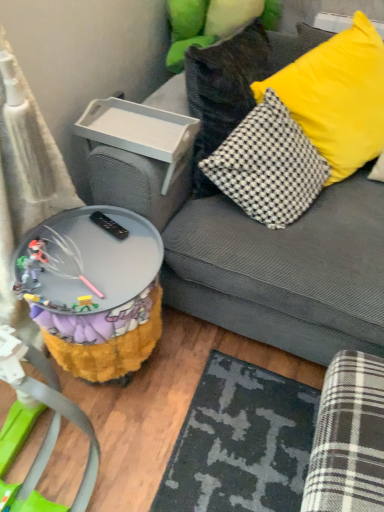
Question: Can we say yellow fabric pillow at upper right lies outside white plastic tray at upper left?

Choices:
 (A) yes
 (B) no

Answer: (A)

Question: Is white plastic tray at upper left surrounded by yellow fabric pillow at upper right?

Choices:
 (A) yes
 (B) no

Answer: (B)

Question: Is yellow fabric pillow at upper right turned away from white plastic tray at upper left?

Choices:
 (A) no
 (B) yes

Answer: (A)

Question: From a real-world perspective, is yellow fabric pillow at upper right over white plastic tray at upper left?

Choices:
 (A) yes
 (B) no

Answer: (A)

Question: Considering the relative positions of yellow fabric pillow at upper right and white plastic tray at upper left in the image provided, is yellow fabric pillow at upper right in front of white plastic tray at upper left?

Choices:
 (A) yes
 (B) no

Answer: (A)

Question: From the image's perspective, is yellow fabric pillow at upper right on white plastic tray at upper left?

Choices:
 (A) no
 (B) yes

Answer: (B)

Question: Is white plastic tray at upper left at the right side of fuzzy fabric table at lower left?

Choices:
 (A) no
 (B) yes

Answer: (B)

Question: Does white plastic tray at upper left have a greater height compared to fuzzy fabric table at lower left?

Choices:
 (A) no
 (B) yes

Answer: (A)

Question: Is white plastic tray at upper left not close to fuzzy fabric table at lower left?

Choices:
 (A) no
 (B) yes

Answer: (A)

Question: Is white plastic tray at upper left not within fuzzy fabric table at lower left?

Choices:
 (A) no
 (B) yes

Answer: (B)

Question: Would you say white plastic tray at upper left contains fuzzy fabric table at lower left?

Choices:
 (A) no
 (B) yes

Answer: (A)

Question: Does white plastic tray at upper left have a greater width compared to fuzzy fabric table at lower left?

Choices:
 (A) no
 (B) yes

Answer: (A)

Question: Can you confirm if fuzzy fabric table at lower left is shorter than gray fabric couch at upper right?

Choices:
 (A) yes
 (B) no

Answer: (A)